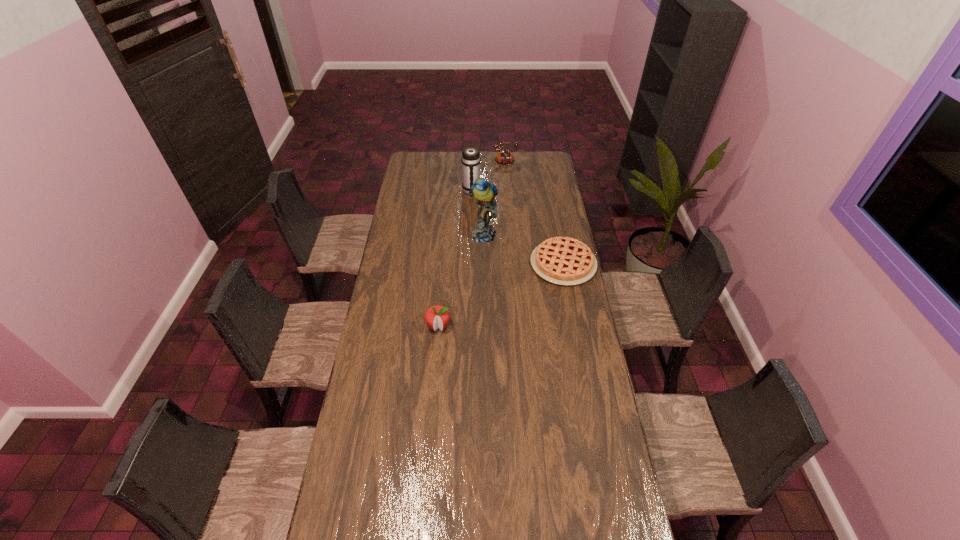
Where is `object at the right edge`? The width and height of the screenshot is (960, 540). object at the right edge is located at coordinates (561, 260).

Where is `vacant region at the far edge of the desktop`? Image resolution: width=960 pixels, height=540 pixels. vacant region at the far edge of the desktop is located at coordinates (526, 165).

In order to click on free location at the left edge of the desktop in this screenshot , I will do `click(397, 327)`.

Image resolution: width=960 pixels, height=540 pixels. In the image, there is a desktop. Identify the location of vacant space at the right edge. (556, 333).

The image size is (960, 540). Find the location of `vacant space at the far left corner of the desktop`. vacant space at the far left corner of the desktop is located at coordinates (412, 165).

Identify the location of vacant space at the far right corner of the desktop. (545, 160).

In the image, there is a desktop. Where is `vacant space at the near right corner`? vacant space at the near right corner is located at coordinates (612, 497).

At what (x,y) coordinates should I click in order to perform the action: click on vacant space that's between the telephone and the rightmost object. Please return your answer as a coordinate pair (x, y). The image size is (960, 540). Looking at the image, I should click on (529, 213).

Locate an element on the screen. vacant area that lies between the leftmost object and the fourth nearest object is located at coordinates (455, 259).

Where is `free spot between the telephone and the pie`? This screenshot has width=960, height=540. free spot between the telephone and the pie is located at coordinates (529, 213).